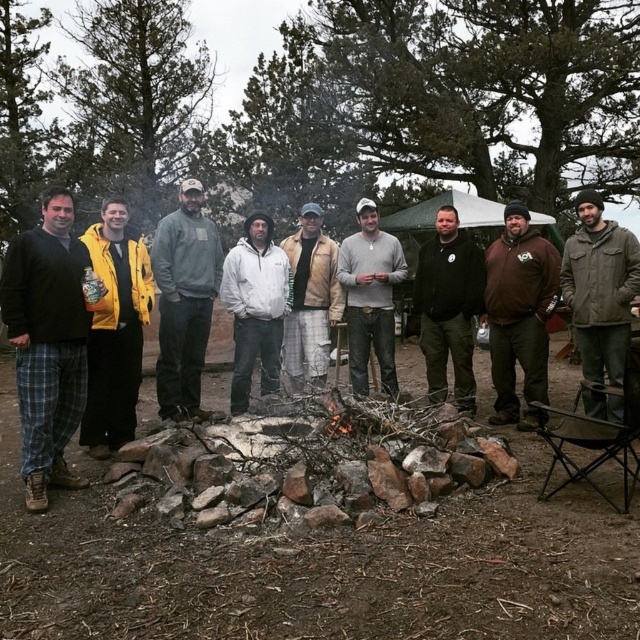
Which is more to the left, black matte jacket at center or leather jacket at center?

From the viewer's perspective, leather jacket at center appears more on the left side.

Can you confirm if black matte jacket at center is smaller than leather jacket at center?

Yes.

Between point (465, 364) and point (312, 307), which one is positioned behind?

The point (312, 307) is more distant.

Image resolution: width=640 pixels, height=640 pixels. I want to click on black matte jacket at center, so click(x=449, y=307).

Does dark gray fleece jacket at center appear on the left side of white fleece jacket at center?

Indeed, dark gray fleece jacket at center is positioned on the left side of white fleece jacket at center.

Between point (218, 278) and point (228, 301), which one is positioned in front?

Point (228, 301)

Is point (205, 268) farther from camera compared to point (257, 307)?

Yes, it is.

Locate an element on the screen. Image resolution: width=640 pixels, height=640 pixels. dark gray fleece jacket at center is located at coordinates (184, 300).

Who is more distant from viewer, (138, 364) or (321, 301)?

The point (321, 301) is more distant.

Does point (115, 387) come behind point (292, 237)?

No, (115, 387) is in front of (292, 237).

The height and width of the screenshot is (640, 640). I want to click on yellow matte jacket at left, so click(115, 332).